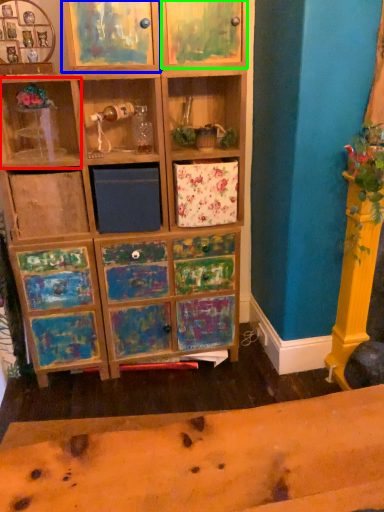
Question: Which object is the farthest from shelf (highlighted by a red box)? Choose among these: cabinet (highlighted by a blue box) or cabinet (highlighted by a green box).

Choices:
 (A) cabinet
 (B) cabinet

Answer: (B)